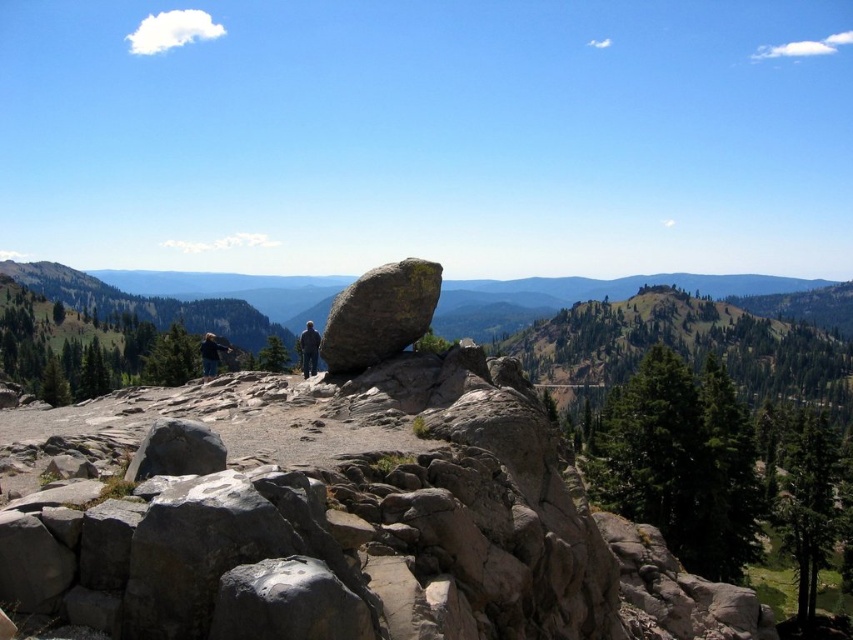
You are standing at the edge of the rocky outcrop and want to walk towards the two points marked in the image. Which point, point (384, 333) or point (213, 349), is closer to you?

Point (384, 333) is in front of point (213, 349), so it is closer to you.

You are a photographer positioned at the edge of the rocky outcrop. You want to capture a photo where both the smooth gray rock at center and the dark gray fabric pants at center are clearly visible. Which object should you focus on first to ensure both are in sharp focus?

You should focus on the smooth gray rock at center first because it is closer to the viewer than the dark gray fabric pants at center. By focusing on the closer object, the farther object will also be in focus due to the depth of field.

From the picture: You are a photographer standing at the edge of the rocky outcrop. You want to take a photo of the smooth gray rock at center and the dark blue jeans at center. If your camera has a maximum focus range of 60 feet, will both subjects be in focus?

The smooth gray rock at center is 70.05 feet away from the dark blue jeans at center. Since the camera can only focus up to 60 feet, the subjects are too far apart for both to be in focus simultaneously.